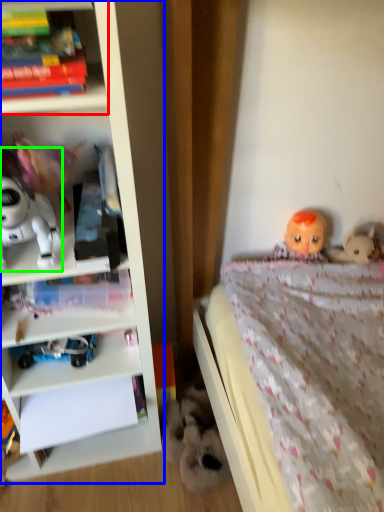
Question: Considering the real-world distances, which object is farthest from shelf (highlighted by a red box)? bookcase (highlighted by a blue box) or toy (highlighted by a green box)?

Choices:
 (A) bookcase
 (B) toy

Answer: (A)